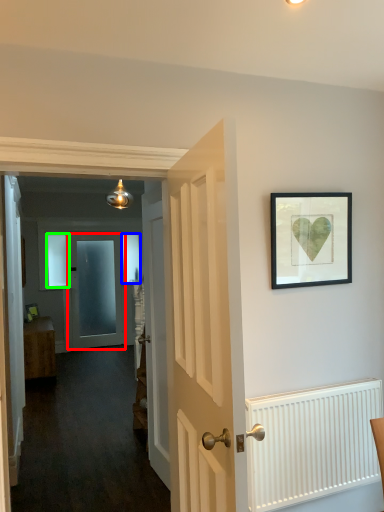
Question: Which is nearer to the door (highlighted by a red box)? window (highlighted by a blue box) or window (highlighted by a green box).

Choices:
 (A) window
 (B) window

Answer: (A)